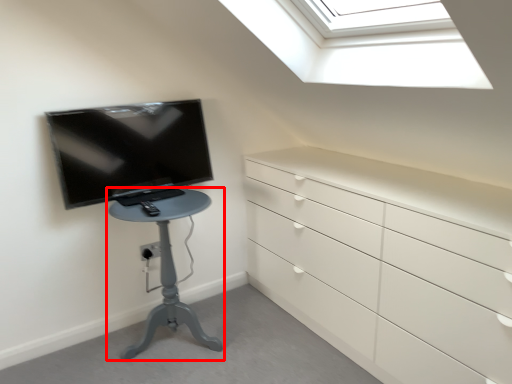
Question: In this image, where is furniture (annotated by the red box) located relative to television?

Choices:
 (A) left
 (B) right

Answer: (B)